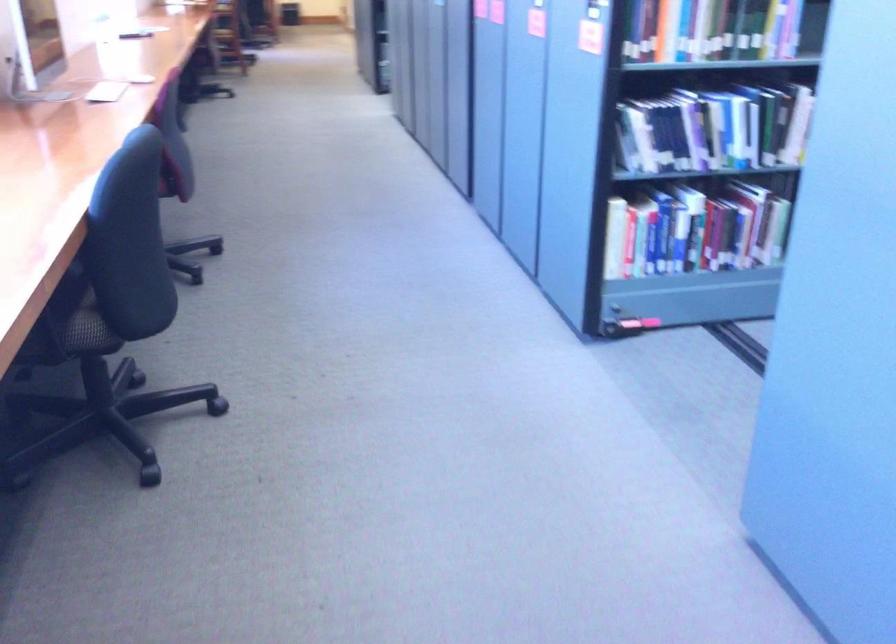
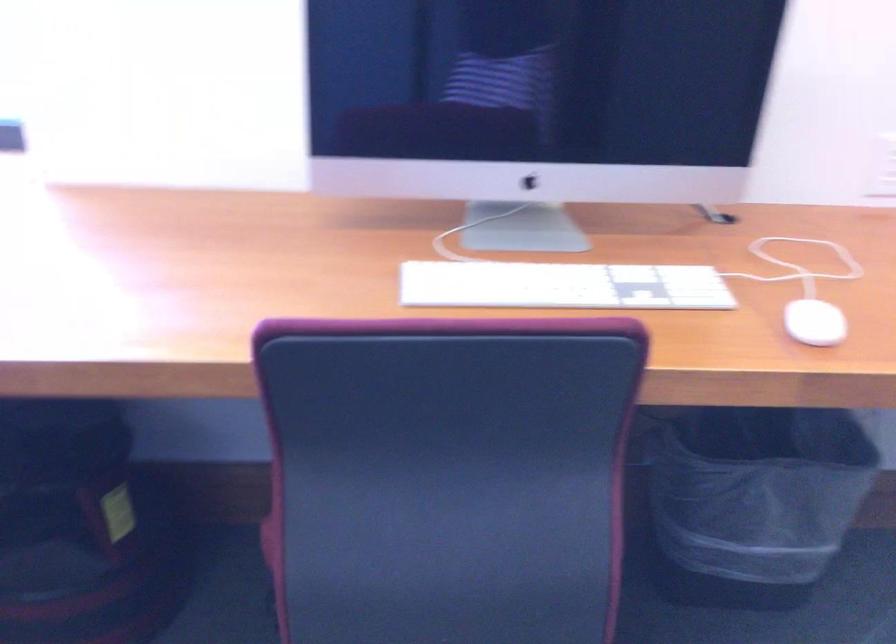
Find the pixel in the second image that matches pixel 125 86 in the first image.

(562, 285)